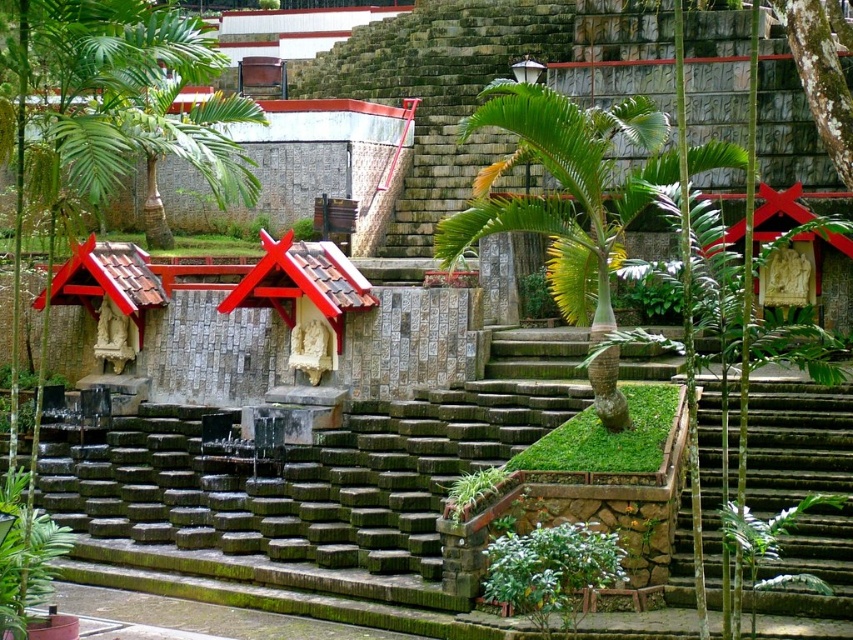
Question: Which object appears farthest from the camera in this image?

Choices:
 (A) green leafy tree at center
 (B) green leafy tree at left
 (C) green stone stairs at lower right
 (D) green mossy bark tree at upper center

Answer: (C)

Question: Which point is closer to the camera?

Choices:
 (A) (833, 140)
 (B) (572, 184)
 (C) (26, 35)

Answer: (C)

Question: Observing the image, what is the correct spatial positioning of green leafy tree at left in reference to green stone stairs at lower right?

Choices:
 (A) left
 (B) right

Answer: (A)

Question: Is green leafy tree at center bigger than green mossy bark tree at upper center?

Choices:
 (A) yes
 (B) no

Answer: (A)

Question: Is green leafy tree at left to the right of green leafy tree at center from the viewer's perspective?

Choices:
 (A) no
 (B) yes

Answer: (A)

Question: Which point is closer to the camera?

Choices:
 (A) (840, 88)
 (B) (606, 164)
 (C) (100, 8)

Answer: (C)